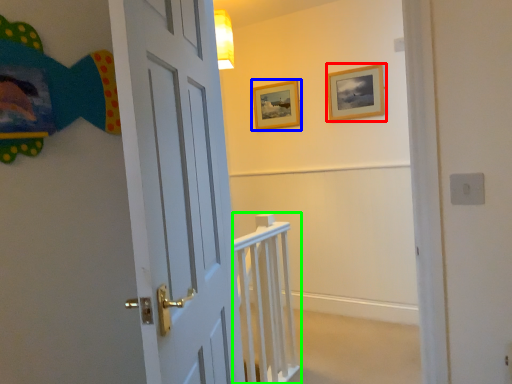
Question: Considering the real-world distances, which object is farthest from picture frame (highlighted by a red box)? picture frame (highlighted by a blue box) or rail (highlighted by a green box)?

Choices:
 (A) picture frame
 (B) rail

Answer: (B)